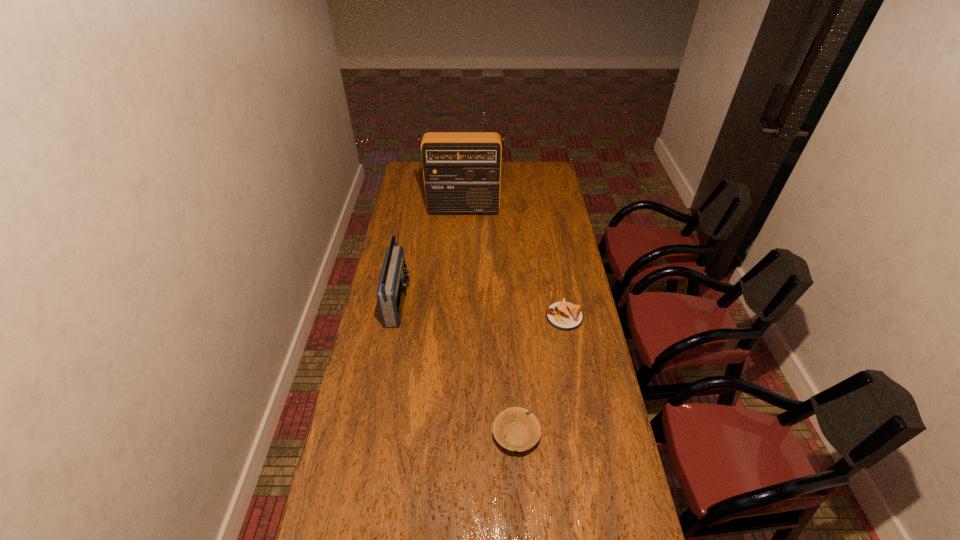
The image size is (960, 540). I want to click on vacant space situated 0.280m on the back of the rightmost object, so 554,259.

Locate an element on the screen. object located in the right edge section of the desktop is located at coordinates pyautogui.click(x=563, y=315).

Where is `vacant space at the left edge of the desktop`? Image resolution: width=960 pixels, height=540 pixels. vacant space at the left edge of the desktop is located at coordinates (399, 189).

Where is `vacant space at the right edge`? Image resolution: width=960 pixels, height=540 pixels. vacant space at the right edge is located at coordinates (574, 272).

Image resolution: width=960 pixels, height=540 pixels. Identify the location of vacant area between the rightmost object and the nearer radio receiver. (481, 309).

You are a GUI agent. You are given a task and a screenshot of the screen. Output one action in this format:
    pyautogui.click(x=<x>, y=<y>)
    Task: Click on the free space between the bowl and the right radio receiver
    This screenshot has height=540, width=960.
    Given the screenshot: What is the action you would take?
    pyautogui.click(x=490, y=322)

This screenshot has width=960, height=540. In order to click on free space between the shortest object and the tallest object in this screenshot , I will do `click(514, 263)`.

In order to click on free space that is in between the second tallest object and the bowl in this screenshot , I will do `click(457, 369)`.

Where is `unoccupied position between the rightmost object and the nearest object`? This screenshot has width=960, height=540. unoccupied position between the rightmost object and the nearest object is located at coordinates (540, 376).

The width and height of the screenshot is (960, 540). What are the coordinates of `free space that is in between the farther radio receiver and the nearest object` in the screenshot? It's located at (490, 322).